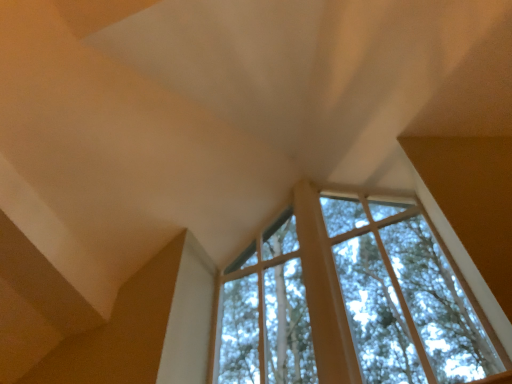
In order to face clear glass window at center, should I rotate leftwards or rightwards?

Rotate your view right by about 8.038°.

Measure the distance between point (248, 300) and camera.

They are 14.17 feet apart.

This screenshot has width=512, height=384. What are the coordinates of `clear glass window at center` in the screenshot? It's located at pos(351,299).

Describe the element at coordinates (351, 299) in the screenshot. I see `clear glass window at center` at that location.

Find the location of a particular element. clear glass window at center is located at coordinates (351, 299).